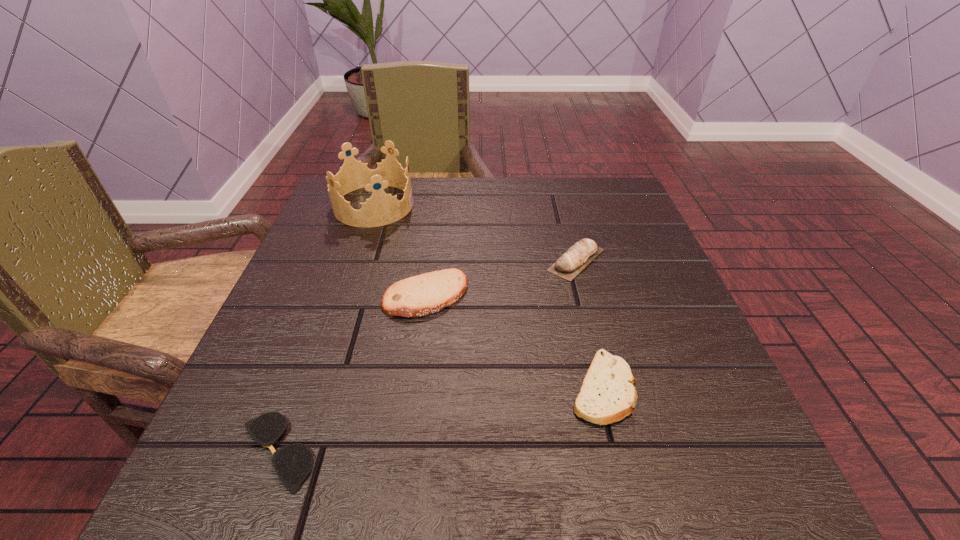
Find the location of a particular element. The image size is (960, 540). the farthest object is located at coordinates (380, 209).

You are a GUI agent. You are given a task and a screenshot of the screen. Output one action in this format:
    pyautogui.click(x=<x>, y=<y>)
    Task: Click on the tallest object
    The width and height of the screenshot is (960, 540).
    Given the screenshot: What is the action you would take?
    pyautogui.click(x=380, y=209)

This screenshot has width=960, height=540. Identify the location of the leftmost pita bread. (424, 294).

At what (x,y) coordinates should I click in order to perform the action: click on the nearest pita bread. Please return your answer as a coordinate pair (x, y). The width and height of the screenshot is (960, 540). Looking at the image, I should click on (607, 395).

Locate an element on the screen. The height and width of the screenshot is (540, 960). the shortest pita bread is located at coordinates (607, 395).

Where is `the shortest object`? The width and height of the screenshot is (960, 540). the shortest object is located at coordinates (293, 463).

Find the location of a particular element. This screenshot has height=540, width=960. vacant point located 0.190m on the front-facing side of the tallest object is located at coordinates tap(492, 205).

Image resolution: width=960 pixels, height=540 pixels. Find the location of `blank space located 0.190m on the back of the leftmost pita bread`. blank space located 0.190m on the back of the leftmost pita bread is located at coordinates (436, 220).

Locate an element on the screen. The image size is (960, 540). vacant space situated 0.270m on the back of the shortest pita bread is located at coordinates (569, 252).

Identify the location of vacant space located on the back of the spectacles. This screenshot has height=540, width=960. (324, 318).